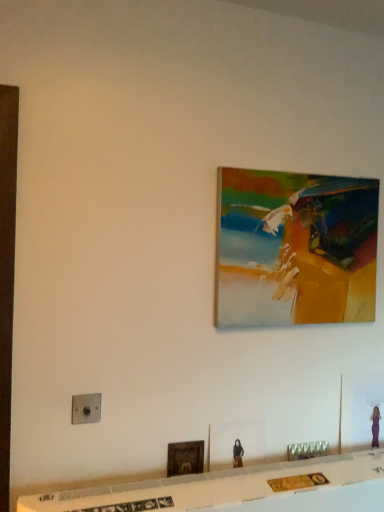
Question: Is point (177, 451) positioned closer to the camera than point (82, 414)?

Choices:
 (A) farther
 (B) closer

Answer: (A)

Question: Considering the positions of metallic gold picture frame at lower center, placed as the 2th picture frame when sorted from back to front, and satin silver switch at lower left in the image, is metallic gold picture frame at lower center, placed as the 2th picture frame when sorted from back to front, bigger or smaller than satin silver switch at lower left?

Choices:
 (A) small
 (B) big

Answer: (B)

Question: Estimate the real-world distances between objects in this image. Which object is farther from the satin silver switch at lower left?

Choices:
 (A) oil painting at upper center, positioned as the first picture frame in top-to-bottom order
 (B) metallic gold picture frame at lower center, which ranks as the 1th picture frame in bottom-to-top order
 (C) metallic gold decorative piece at lower center

Answer: (A)

Question: Which is nearer to the oil painting at upper center, the second picture frame ordered from the bottom?

Choices:
 (A) satin silver switch at lower left
 (B) metallic gold picture frame at lower center, the 2th picture frame in the right-to-left sequence
 (C) metallic gold decorative piece at lower center

Answer: (C)